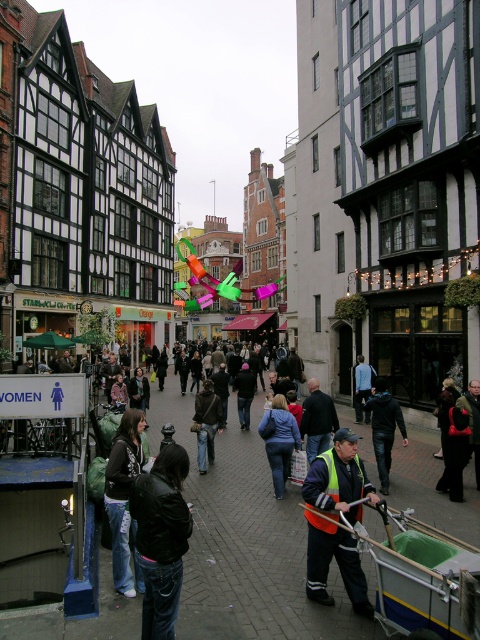
You are standing at the entrance of the Starbucks shop on the left side of the street. You want to hand a flyer to the person wearing the dark blue jacket at center. In which direction should you walk to reach them?

The dark blue jacket at center is located at point (317, 420), which is to the right and slightly forward from your current position at the Starbucks entrance. You should walk towards the center of the street towards the right to reach them.

You are a tailor who needs to determine which jacket requires more fabric for a custom order. Based on the image, which jacket between the black leather jacket at lower left and the denim jacket at center would need more fabric?

The black leather jacket at lower left requires more fabric because its width is larger than the denim jacket at center.